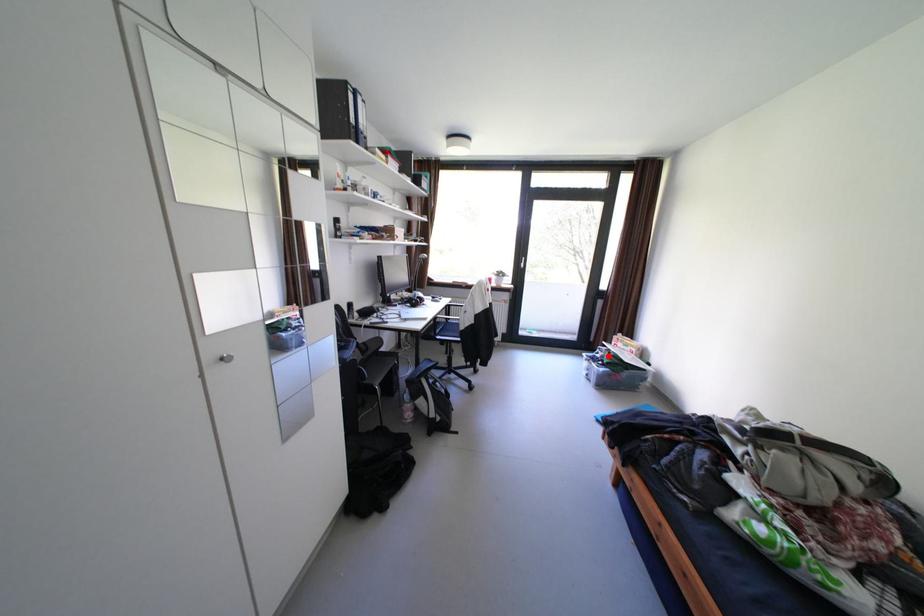
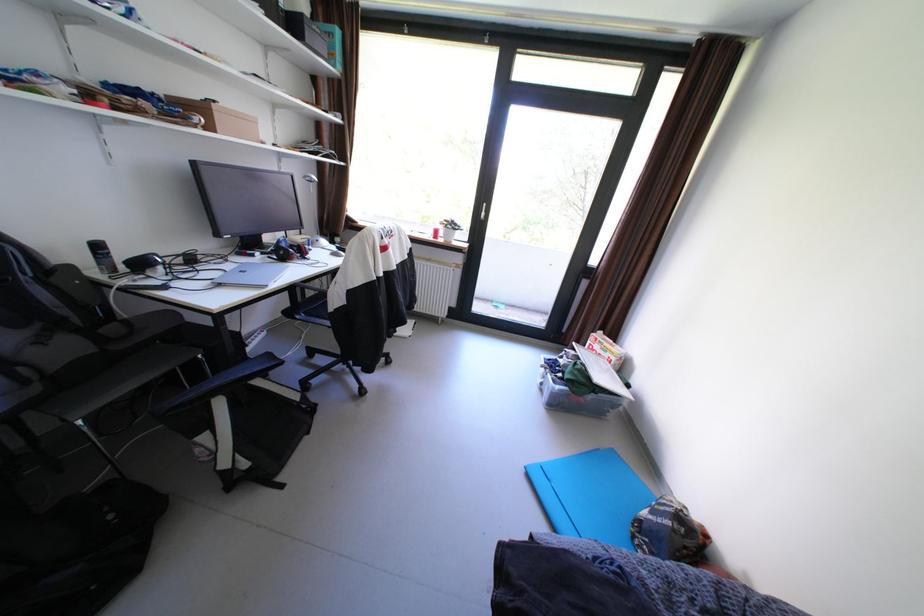
Question: I am providing you with two images of the same scene from different viewpoints. In image1, a red point is highlighted. Considering the same 3D point in image2, which of the following is correct?

Choices:
 (A) It is closer
 (B) It is farther

Answer: (B)